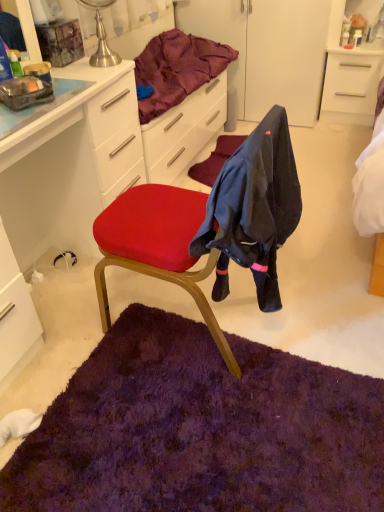
What do you see at coordinates (351, 69) in the screenshot? This screenshot has height=512, width=384. I see `white glossy cabinet at upper right, acting as the 1th cabinetry starting from the back` at bounding box center [351, 69].

At what (x,y) coordinates should I click in order to perform the action: click on velvet purple blanket at upper center. Please return your answer as a coordinate pair (x, y). This screenshot has width=384, height=512. Looking at the image, I should click on (177, 69).

Where is `velvet red chair at center`? velvet red chair at center is located at coordinates (210, 226).

The width and height of the screenshot is (384, 512). Describe the element at coordinates (210, 226) in the screenshot. I see `velvet red chair at center` at that location.

I want to click on white glossy cabinet at upper right, positioned as the 2th cabinetry in bottom-to-top order, so click(x=351, y=69).

Which is behind, white glossy cabinet at left, the 2th cabinetry viewed from the right, or dark blue fabric at center?

white glossy cabinet at left, the 2th cabinetry viewed from the right.

Is white glossy cabinet at left, arranged as the 1th cabinetry when viewed from the front, oriented towards dark blue fabric at center?

Yes, white glossy cabinet at left, arranged as the 1th cabinetry when viewed from the front, is oriented towards dark blue fabric at center.

Can you confirm if white glossy cabinet at left, the 2th cabinetry viewed from the right, is positioned to the right of dark blue fabric at center?

Incorrect, white glossy cabinet at left, the 2th cabinetry viewed from the right, is not on the right side of dark blue fabric at center.

How different are the orientations of white glossy cabinet at left, arranged as the 2th cabinetry when viewed from the top, and dark blue fabric at center in degrees?

white glossy cabinet at left, arranged as the 2th cabinetry when viewed from the top, and dark blue fabric at center are facing 178 degrees away from each other.

Looking at this image, is velvet purple blanket at upper center positioned with its back to velvet red chair at center?

That's not correct — velvet purple blanket at upper center is not looking away from velvet red chair at center.

Is velvet purple blanket at upper center bigger than velvet red chair at center?

No.

Would you consider velvet purple blanket at upper center to be distant from velvet red chair at center?

That's not correct — velvet purple blanket at upper center is a little close to velvet red chair at center.

Could you tell me if purple shaggy mat at lower center is facing white glossy cabinet at left, arranged as the 1th cabinetry when viewed from the front?

No, purple shaggy mat at lower center is not turned towards white glossy cabinet at left, arranged as the 1th cabinetry when viewed from the front.

In terms of height, does purple shaggy mat at lower center look taller or shorter compared to white glossy cabinet at left, which is the first cabinetry from bottom to top?

Considering their sizes, purple shaggy mat at lower center has less height than white glossy cabinet at left, which is the first cabinetry from bottom to top.

Does purple shaggy mat at lower center have a larger size compared to white glossy cabinet at left, placed as the 1th cabinetry when sorted from left to right?

No.

Are purple shaggy mat at lower center and white glossy cabinet at left, the 2th cabinetry viewed from the right, beside each other?

No, purple shaggy mat at lower center is not touching white glossy cabinet at left, the 2th cabinetry viewed from the right.

Is dark blue fabric at center smaller than velvet purple blanket at upper center?

Yes, dark blue fabric at center is smaller than velvet purple blanket at upper center.

Considering the positions of objects dark blue fabric at center and velvet purple blanket at upper center in the image provided, who is behind, dark blue fabric at center or velvet purple blanket at upper center?

Positioned behind is velvet purple blanket at upper center.

Between dark blue fabric at center and velvet purple blanket at upper center, which one has smaller width?

dark blue fabric at center is thinner.

Which of these two, velvet purple blanket at upper center or white glossy cabinet at left, which is the first cabinetry from bottom to top, stands taller?

With more height is white glossy cabinet at left, which is the first cabinetry from bottom to top.

Between point (208, 77) and point (145, 170), which one is positioned in front?

The point (145, 170) is more forward.

Considering the relative sizes of velvet purple blanket at upper center and white glossy cabinet at left, which is the first cabinetry from bottom to top, in the image provided, is velvet purple blanket at upper center smaller than white glossy cabinet at left, which is the first cabinetry from bottom to top,?

Yes.

Measure the distance between velvet purple blanket at upper center and white glossy cabinet at left, placed as the 1th cabinetry when sorted from left to right.

velvet purple blanket at upper center is 22.74 inches from white glossy cabinet at left, placed as the 1th cabinetry when sorted from left to right.

Considering the positions of objects white glossy cabinet at upper right, the second cabinetry when ordered from left to right, and velvet purple blanket at upper center in the image provided, who is more to the right, white glossy cabinet at upper right, the second cabinetry when ordered from left to right, or velvet purple blanket at upper center?

From the viewer's perspective, white glossy cabinet at upper right, the second cabinetry when ordered from left to right, appears more on the right side.

Can you confirm if white glossy cabinet at upper right, arranged as the first cabinetry when viewed from the top, is smaller than velvet purple blanket at upper center?

Indeed, white glossy cabinet at upper right, arranged as the first cabinetry when viewed from the top, has a smaller size compared to velvet purple blanket at upper center.

Does point (359, 66) appear closer or farther from the camera than point (195, 66)?

Point (359, 66) is positioned farther from the camera compared to point (195, 66).

Locate an element on the screen. cabinetry located above the velvet purple blanket at upper center (from the image's perspective) is located at coordinates (351, 69).

Which object is positioned more to the left, white glossy cabinet at left, arranged as the 2th cabinetry when viewed from the top, or white glossy cabinet at upper right, the second cabinetry when ordered from front to back?

From the viewer's perspective, white glossy cabinet at left, arranged as the 2th cabinetry when viewed from the top, appears more on the left side.

Locate an element on the screen. cabinetry that appears in front of the white glossy cabinet at upper right, arranged as the first cabinetry when viewed from the top is located at coordinates (71, 165).

Is white glossy cabinet at left, placed as the 1th cabinetry when sorted from left to right, inside the boundaries of white glossy cabinet at upper right, the second cabinetry when ordered from front to back, or outside?

white glossy cabinet at left, placed as the 1th cabinetry when sorted from left to right, is not inside white glossy cabinet at upper right, the second cabinetry when ordered from front to back, it's outside.

The width and height of the screenshot is (384, 512). In order to click on clothing located above the white glossy cabinet at left, arranged as the 2th cabinetry when viewed from the top (from a real-world perspective) in this screenshot , I will do `click(253, 209)`.

In the image, there is a velvet red chair at center. Where is `bedding above it (from the image's perspective)`? Image resolution: width=384 pixels, height=512 pixels. bedding above it (from the image's perspective) is located at coordinates (177, 69).

Estimate the real-world distances between objects in this image. Which object is closer to white glossy cabinet at left, placed as the 1th cabinetry when sorted from left to right, purple shaggy mat at lower center or velvet purple blanket at upper center?

velvet purple blanket at upper center is positioned closer to the anchor white glossy cabinet at left, placed as the 1th cabinetry when sorted from left to right.

Considering their positions, is velvet red chair at center positioned further to dark blue fabric at center than purple shaggy mat at lower center?

Based on the image, purple shaggy mat at lower center appears to be further to dark blue fabric at center.

Considering their positions, is white glossy cabinet at upper right, acting as the 1th cabinetry starting from the back, positioned further to dark blue fabric at center than velvet red chair at center?

The object further to dark blue fabric at center is white glossy cabinet at upper right, acting as the 1th cabinetry starting from the back.

Which object lies nearer to the anchor point velvet purple blanket at upper center, dark blue fabric at center or velvet red chair at center?

velvet red chair at center is closer to velvet purple blanket at upper center.

From the image, which object appears to be farther from white glossy cabinet at left, placed as the 1th cabinetry when sorted from left to right, white glossy cabinet at upper right, the second cabinetry when ordered from left to right, or velvet purple blanket at upper center?

The object further to white glossy cabinet at left, placed as the 1th cabinetry when sorted from left to right, is white glossy cabinet at upper right, the second cabinetry when ordered from left to right.

Based on their spatial positions, is dark blue fabric at center or white glossy cabinet at upper right, positioned as the 2th cabinetry in bottom-to-top order, closer to velvet red chair at center?

Based on the image, dark blue fabric at center appears to be nearer to velvet red chair at center.

When comparing their distances from white glossy cabinet at upper right, the second cabinetry when ordered from left to right, does dark blue fabric at center or white glossy cabinet at left, arranged as the 2th cabinetry when viewed from the top, seem closer?

Based on the image, white glossy cabinet at left, arranged as the 2th cabinetry when viewed from the top, appears to be nearer to white glossy cabinet at upper right, the second cabinetry when ordered from left to right.

When comparing their distances from velvet purple blanket at upper center, does purple shaggy mat at lower center or white glossy cabinet at upper right, positioned as the 2th cabinetry in bottom-to-top order, seem closer?

Among the two, white glossy cabinet at upper right, positioned as the 2th cabinetry in bottom-to-top order, is located nearer to velvet purple blanket at upper center.

Find the location of a particular element. The height and width of the screenshot is (512, 384). bedding located between dark blue fabric at center and white glossy cabinet at upper right, arranged as the first cabinetry when viewed from the top, in the depth direction is located at coordinates (177, 69).

Identify the location of chair between velvet purple blanket at upper center and purple shaggy mat at lower center in the up-down direction. The height and width of the screenshot is (512, 384). (210, 226).

Where is `chair positioned between purple shaggy mat at lower center and white glossy cabinet at upper right, the second cabinetry when ordered from front to back, from near to far`? Image resolution: width=384 pixels, height=512 pixels. chair positioned between purple shaggy mat at lower center and white glossy cabinet at upper right, the second cabinetry when ordered from front to back, from near to far is located at coordinates (210, 226).

Locate an element on the screen. bedding between white glossy cabinet at upper right, the first cabinetry in the right-to-left sequence, and purple shaggy mat at lower center, in the vertical direction is located at coordinates (177, 69).